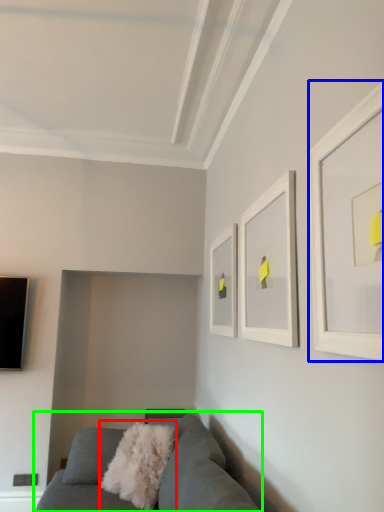
Question: Which object is positioned farthest from throw pillow (highlighted by a red box)? Select from picture frame (highlighted by a blue box) and studio couch (highlighted by a green box).

Choices:
 (A) picture frame
 (B) studio couch

Answer: (A)